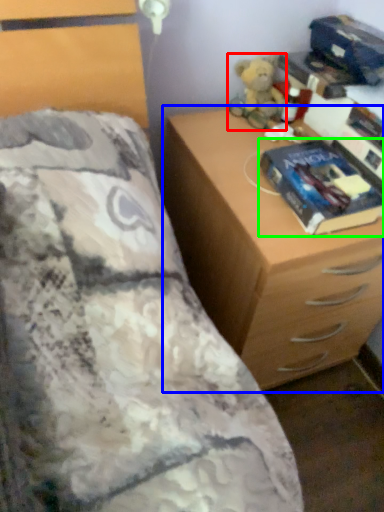
Question: Based on their relative distances, which object is nearer to toy (highlighted by a red box)? Choose from chest of drawers (highlighted by a blue box) and paperback book (highlighted by a green box).

Choices:
 (A) chest of drawers
 (B) paperback book

Answer: (B)